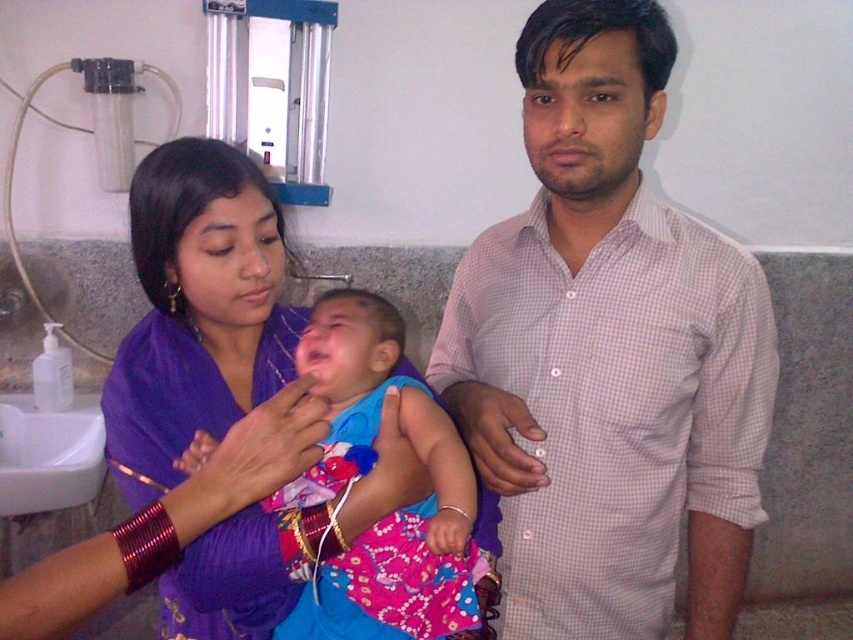
Is pink checkered shirt at center to the left of purple fabric at center from the viewer's perspective?

In fact, pink checkered shirt at center is to the right of purple fabric at center.

Image resolution: width=853 pixels, height=640 pixels. I want to click on pink checkered shirt at center, so click(608, 355).

At what (x,y) coordinates should I click in order to perform the action: click on pink checkered shirt at center. Please return your answer as a coordinate pair (x, y). The image size is (853, 640). Looking at the image, I should click on (608, 355).